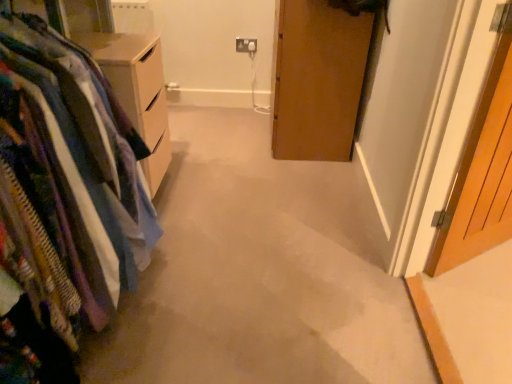
Describe the element at coordinates (246, 45) in the screenshot. The image size is (512, 384). I see `white plastic electric outlet at upper center` at that location.

Image resolution: width=512 pixels, height=384 pixels. What do you see at coordinates (63, 199) in the screenshot?
I see `textured fabric closet at left` at bounding box center [63, 199].

Describe the element at coordinates (482, 170) in the screenshot. This screenshot has width=512, height=384. I see `wooden door at right` at that location.

Find the location of a particular element. white plastic electric outlet at upper center is located at coordinates (246, 45).

Does point (477, 197) come in front of point (48, 376)?

That is False.

Can you tell me how much wooden door at right and textured fabric closet at left differ in facing direction?

The angular difference between wooden door at right and textured fabric closet at left is 56 degrees.

Does wooden door at right have a lesser height compared to textured fabric closet at left?

Incorrect, the height of wooden door at right does not fall short of that of textured fabric closet at left.

Can you confirm if wooden door at right is wider than textured fabric closet at left?

Incorrect, the width of wooden door at right does not surpass that of textured fabric closet at left.

Looking at this image, from a real-world perspective, which object stands above the other?

white plastic electric outlet at upper center, from a real-world perspective.

From the picture: From the image's perspective, between white plastic electric outlet at upper center and textured fabric closet at left, who is located below?

textured fabric closet at left, from the image's perspective.

Is white plastic electric outlet at upper center positioned far away from textured fabric closet at left?

Absolutely, white plastic electric outlet at upper center is distant from textured fabric closet at left.

The height and width of the screenshot is (384, 512). I want to click on closet lying on the left of white plastic electric outlet at upper center, so click(63, 199).

From a real-world perspective, does textured fabric closet at left stand above wooden door at right?

Actually, textured fabric closet at left is physically below wooden door at right in the real world.

Consider the image. Can you see textured fabric closet at left touching wooden door at right?

No, textured fabric closet at left is not with wooden door at right.

From the image's perspective, is textured fabric closet at left located above wooden door at right?

No.

Does point (511, 182) appear closer or farther from the camera than point (245, 41)?

Point (511, 182) is closer to the camera than point (245, 41).

From the image's perspective, does wooden door at right appear lower than white plastic electric outlet at upper center?

Correct, wooden door at right appears lower than white plastic electric outlet at upper center in the image.

From a real-world perspective, is wooden door at right beneath white plastic electric outlet at upper center?

No, from a real-world perspective, wooden door at right is not below white plastic electric outlet at upper center.

Who is more distant, wooden door at right or white plastic electric outlet at upper center?

white plastic electric outlet at upper center is further away from the camera.

Where is `closet in front of the white plastic electric outlet at upper center`? closet in front of the white plastic electric outlet at upper center is located at coordinates 63,199.

Is textured fabric closet at left oriented away from white plastic electric outlet at upper center?

No, textured fabric closet at left's orientation is not away from white plastic electric outlet at upper center.

Is textured fabric closet at left in front of or behind white plastic electric outlet at upper center in the image?

Visually, textured fabric closet at left is located in front of white plastic electric outlet at upper center.

From a real-world perspective, who is located lower, textured fabric closet at left or white plastic electric outlet at upper center?

In real-world perspective, textured fabric closet at left is lower.

Considering the relative positions of white plastic electric outlet at upper center and wooden door at right in the image provided, is white plastic electric outlet at upper center to the left of wooden door at right from the viewer's perspective?

Indeed, white plastic electric outlet at upper center is positioned on the left side of wooden door at right.

In the scene shown: From a real-world perspective, who is located higher, white plastic electric outlet at upper center or wooden door at right?

From a 3D spatial view, wooden door at right is above.

Based on the photo, considering the sizes of objects white plastic electric outlet at upper center and wooden door at right in the image provided, who is shorter, white plastic electric outlet at upper center or wooden door at right?

Standing shorter between the two is white plastic electric outlet at upper center.

Locate an element on the screen. The image size is (512, 384). door lying on the right of textured fabric closet at left is located at coordinates (482, 170).

In order to click on electric outlet that is above the textured fabric closet at left (from the image's perspective) in this screenshot , I will do `click(246, 45)`.

Looking at the image, which one is located further to textured fabric closet at left, wooden door at right or white plastic electric outlet at upper center?

Among the two, white plastic electric outlet at upper center is located further to textured fabric closet at left.

Which object lies further to the anchor point white plastic electric outlet at upper center, textured fabric closet at left or wooden door at right?

textured fabric closet at left.

Estimate the real-world distances between objects in this image. Which object is further from textured fabric closet at left, white plastic electric outlet at upper center or wooden door at right?

white plastic electric outlet at upper center lies further to textured fabric closet at left than the other object.

Considering their positions, is textured fabric closet at left positioned further to wooden door at right than white plastic electric outlet at upper center?

white plastic electric outlet at upper center is further to wooden door at right.

Looking at the image, which one is located further to wooden door at right, white plastic electric outlet at upper center or textured fabric closet at left?

white plastic electric outlet at upper center lies further to wooden door at right than the other object.

Consider the image. Considering their positions, is wooden door at right positioned closer to white plastic electric outlet at upper center than textured fabric closet at left?

wooden door at right.

You are a GUI agent. You are given a task and a screenshot of the screen. Output one action in this format:
    pyautogui.click(x=<x>, y=<y>)
    Task: Click on the door between textured fabric closet at left and white plastic electric outlet at upper center in the front-back direction
    The width and height of the screenshot is (512, 384).
    Given the screenshot: What is the action you would take?
    pyautogui.click(x=482, y=170)